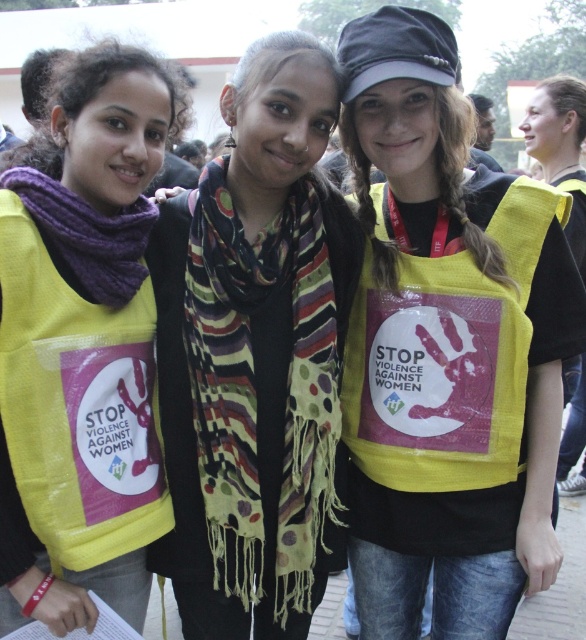
Question: Among these points, which one is farthest from the camera?

Choices:
 (A) (277, 547)
 (B) (510, 493)

Answer: (A)

Question: Which object is farther from the camera taking this photo?

Choices:
 (A) multicolored woven scarf at center
 (B) purple knitted scarf at left
 (C) yellow fabric vest at left
 (D) matte yellow vest at right

Answer: (D)

Question: Is purple knitted scarf at left in front of matte yellow vest at right?

Choices:
 (A) no
 (B) yes

Answer: (B)

Question: Can you confirm if purple knitted scarf at left is smaller than matte yellow vest at right?

Choices:
 (A) no
 (B) yes

Answer: (B)

Question: Can you confirm if yellow fabric vest at left is positioned above matte yellow vest at right?

Choices:
 (A) no
 (B) yes

Answer: (A)

Question: Among these objects, which one is nearest to the camera?

Choices:
 (A) yellow fabric vest at center
 (B) purple knitted scarf at left
 (C) matte yellow vest at right

Answer: (B)